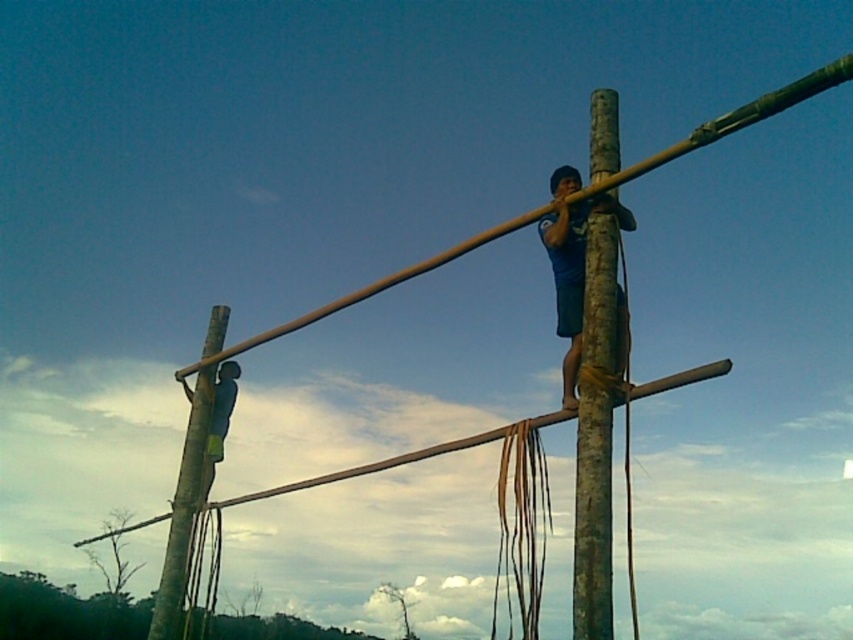
Question: Which is nearer to the brown wood pole at center?

Choices:
 (A) smooth bamboo pole at center
 (B) blue fabric shirt at center

Answer: (B)

Question: Which of the following is the farthest from the observer?

Choices:
 (A) (152, 611)
 (B) (613, 372)
 (C) (566, 250)
 (D) (850, 58)

Answer: (A)

Question: Can you confirm if blue fabric shirt at center is bigger than brown wood pole at left?

Choices:
 (A) no
 (B) yes

Answer: (A)

Question: Does blue fabric shirt at center have a larger size compared to brown wood pole at left?

Choices:
 (A) no
 (B) yes

Answer: (A)

Question: Does blue fabric shirt at center have a greater width compared to brown wood pole at left?

Choices:
 (A) no
 (B) yes

Answer: (B)

Question: Which of these objects is positioned closest to the brown wood pole at left?

Choices:
 (A) brown wood pole at center
 (B) blue fabric shirt at center

Answer: (A)